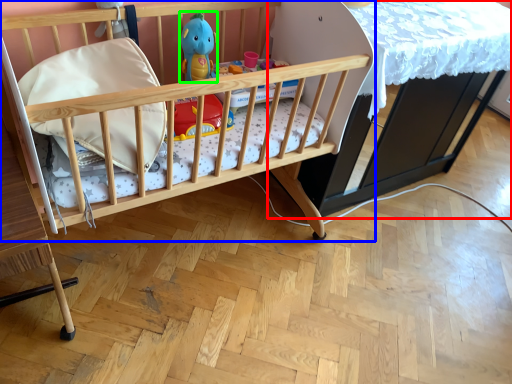
Question: Which object is the closest to the table (highlighted by a red box)? Choose among these: infant bed (highlighted by a blue box) or toy (highlighted by a green box).

Choices:
 (A) infant bed
 (B) toy

Answer: (A)